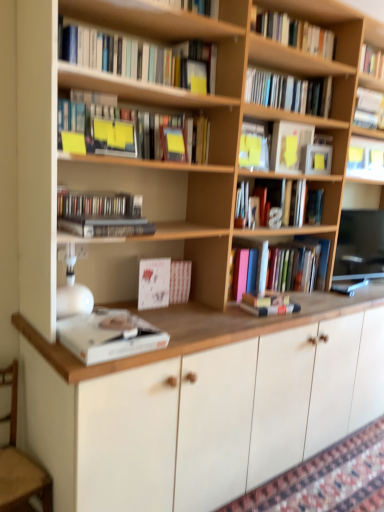
Identify the location of vacant space that's between white matte book at lower left, which is the twelfth book in top-to-bottom order, and white textured book at center, the third book positioned from the bottom. (165, 314).